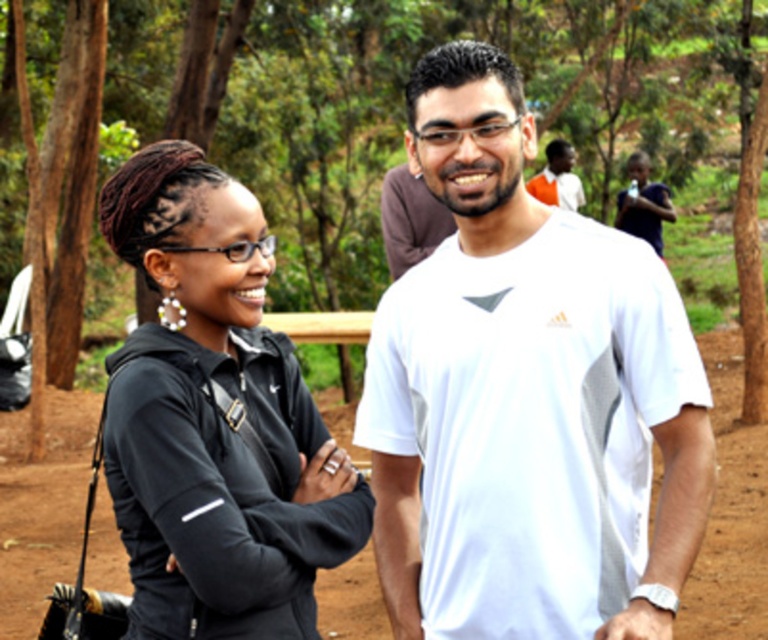
Who is more forward, (623, 522) or (151, 372)?

Positioned in front is point (151, 372).

Is white matte t-shirt at center shorter than black matte jacket at center?

No, white matte t-shirt at center is not shorter than black matte jacket at center.

Image resolution: width=768 pixels, height=640 pixels. In order to click on white matte t-shirt at center in this screenshot , I will do `click(525, 396)`.

Does black matte jacket at center lie behind orange cotton shirt at upper right?

No, it is in front of orange cotton shirt at upper right.

In the scene shown: Does black matte jacket at center appear on the right side of orange cotton shirt at upper right?

In fact, black matte jacket at center is to the left of orange cotton shirt at upper right.

You are a GUI agent. You are given a task and a screenshot of the screen. Output one action in this format:
    pyautogui.click(x=<x>, y=<y>)
    Task: Click on the black matte jacket at center
    This screenshot has height=640, width=768.
    Given the screenshot: What is the action you would take?
    pyautogui.click(x=214, y=419)

Is white matte t-shirt at center to the right of orange cotton shirt at upper right from the viewer's perspective?

No, white matte t-shirt at center is not to the right of orange cotton shirt at upper right.

Can you confirm if white matte t-shirt at center is bigger than orange cotton shirt at upper right?

Incorrect, white matte t-shirt at center is not larger than orange cotton shirt at upper right.

In order to click on white matte t-shirt at center in this screenshot , I will do `click(525, 396)`.